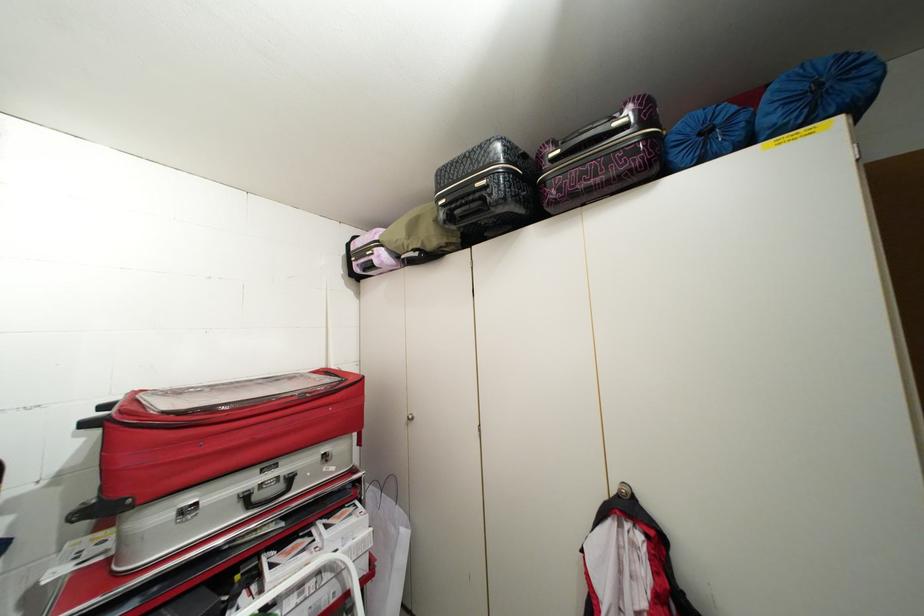
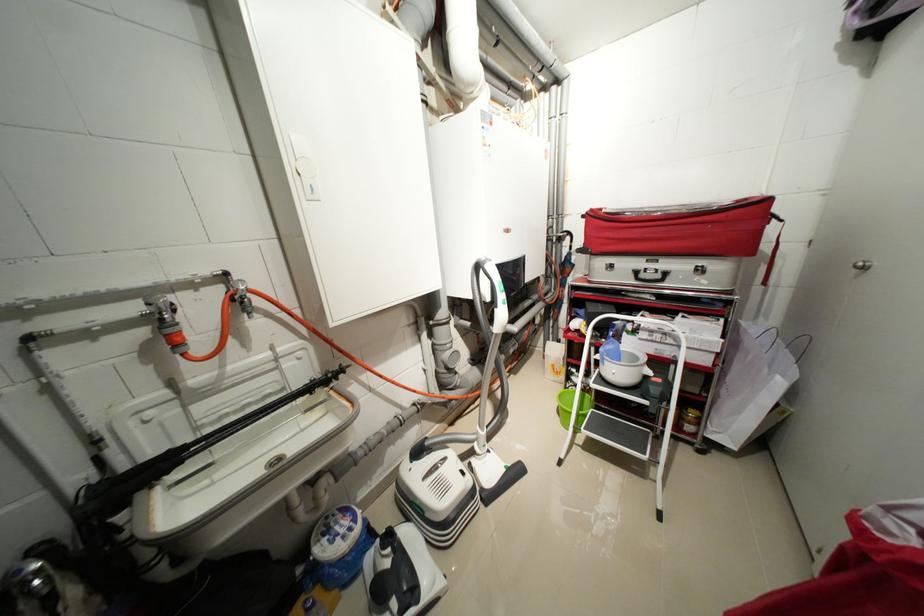
The point at (x=411, y=535) is marked in the first image. Where is the corresponding point in the second image?

(787, 384)